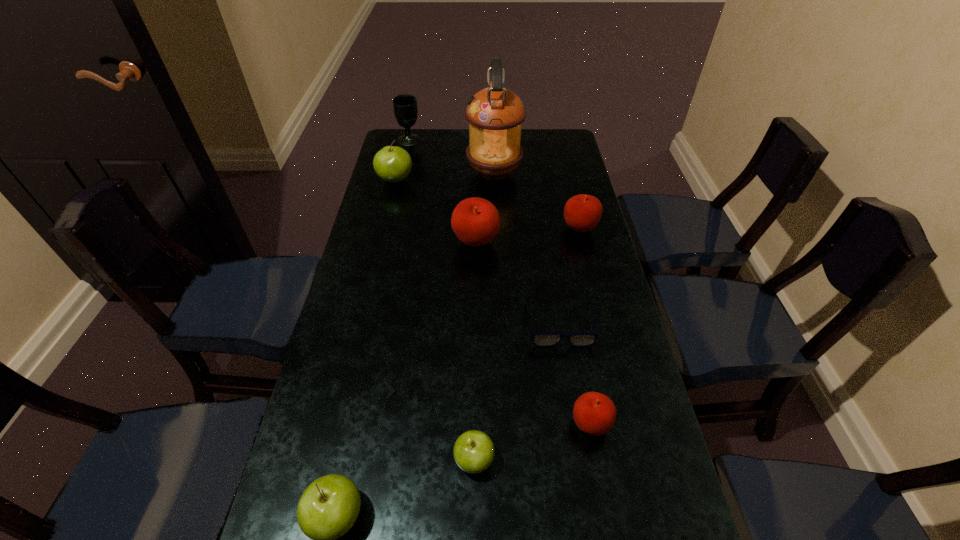
This screenshot has height=540, width=960. Find the location of `oil lamp`. oil lamp is located at coordinates (495, 114).

I want to click on the farthest object, so click(405, 108).

Find the location of a particular element. The image size is (960, 540). the farthest apple is located at coordinates (393, 164).

The height and width of the screenshot is (540, 960). I want to click on the farthest green apple, so click(393, 164).

The height and width of the screenshot is (540, 960). I want to click on the biggest red apple, so click(475, 221).

You are a GUI agent. You are given a task and a screenshot of the screen. Output one action in this format:
    pyautogui.click(x=<x>, y=<y>)
    Task: Click on the second biggest red apple
    Image resolution: width=960 pixels, height=540 pixels.
    Given the screenshot: What is the action you would take?
    pyautogui.click(x=582, y=212)

Find the location of a particular element. This screenshot has height=540, width=960. the smallest green apple is located at coordinates [x=473, y=451].

I want to click on the second farthest green apple, so click(473, 451).

You are a GUI agent. You are given a task and a screenshot of the screen. Output one action in this format:
    pyautogui.click(x=<x>, y=<y>)
    Task: Click on the smallest red apple
    
    Given the screenshot: What is the action you would take?
    pyautogui.click(x=594, y=413)

This screenshot has height=540, width=960. What are the coordinates of `the sixth farthest object` in the screenshot? It's located at (539, 339).